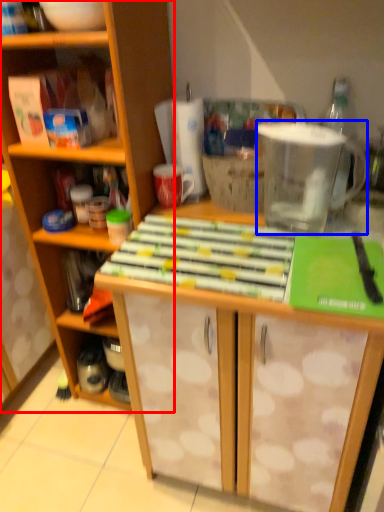
Question: Which object is further to the camera taking this photo, cabinetry (highlighted by a red box) or appliance (highlighted by a blue box)?

Choices:
 (A) cabinetry
 (B) appliance

Answer: (B)